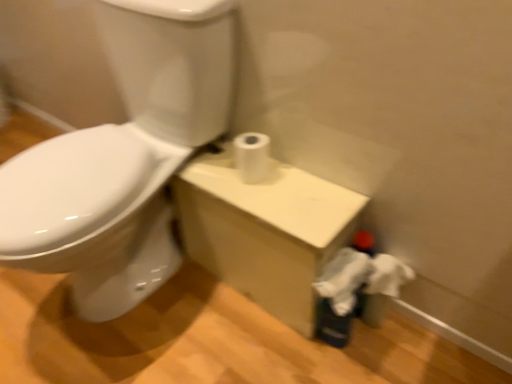
Locate an element on the screen. vacant space in front of white matte toilet paper at center is located at coordinates (276, 197).